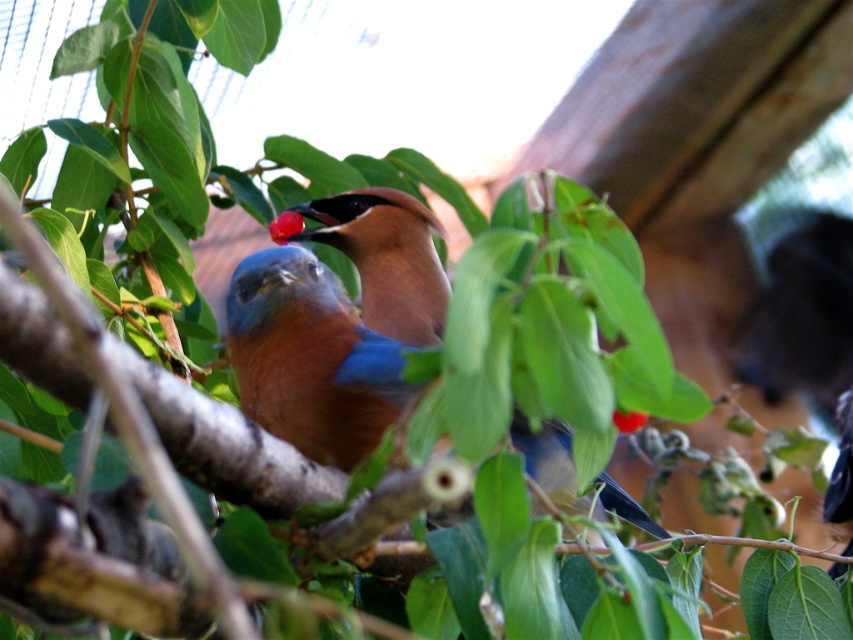
Can you confirm if blue glossy bird at center is positioned to the right of red matte cherry at center?

Indeed, blue glossy bird at center is positioned on the right side of red matte cherry at center.

Between point (378, 326) and point (294, 212), which one is positioned behind?

The point (294, 212) is more distant.

Who is more forward, (x=660, y=529) or (x=274, y=228)?

Point (x=660, y=529) is more forward.

The width and height of the screenshot is (853, 640). In order to click on blue glossy bird at center in this screenshot , I will do `click(387, 259)`.

Is blue glossy bird at center to the left of glossy red berry at center from the viewer's perspective?

Indeed, blue glossy bird at center is positioned on the left side of glossy red berry at center.

Find the location of `blue glossy bird at center`. blue glossy bird at center is located at coordinates (387, 259).

This screenshot has width=853, height=640. Describe the element at coordinates (387, 259) in the screenshot. I see `blue glossy bird at center` at that location.

The height and width of the screenshot is (640, 853). Find the location of `blue glossy bird at center`. blue glossy bird at center is located at coordinates (387, 259).

Can you confirm if red matte cherry at center is positioned above glossy red berry at center?

Indeed, red matte cherry at center is positioned over glossy red berry at center.

Is point (297, 221) closer to camera compared to point (625, 412)?

That is False.

Does point (294, 212) lie behind point (625, 412)?

Yes, point (294, 212) is farther from viewer.

The height and width of the screenshot is (640, 853). In order to click on red matte cherry at center in this screenshot , I will do `click(285, 225)`.